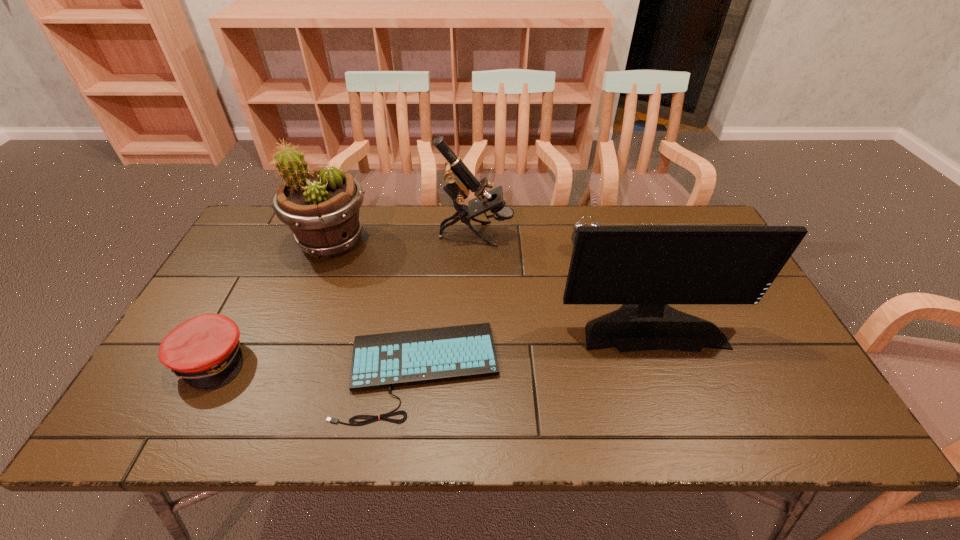
You are a GUI agent. You are given a task and a screenshot of the screen. Output one action in this format:
    pyautogui.click(x=<x>, y=<y>)
    Task: Click on the vacant space located 0.250m at the front of the cap where the visor is located
    The image size is (960, 540).
    Given the screenshot: What is the action you would take?
    pyautogui.click(x=349, y=360)

Find the location of a particular element. This screenshot has width=960, height=540. vacant space situated 0.120m on the left of the shortest object is located at coordinates (290, 369).

This screenshot has height=540, width=960. I want to click on flowerpot that is at the far edge, so click(321, 207).

In order to click on microscope situated at the far edge in this screenshot , I will do `click(459, 179)`.

At what (x,y) coordinates should I click in order to perform the action: click on alarm clock present at the far edge. Please return your answer as a coordinate pair (x, y). The height and width of the screenshot is (540, 960). Looking at the image, I should click on (579, 223).

Locate an element on the screen. This screenshot has height=540, width=960. object situated at the near edge is located at coordinates pyautogui.click(x=386, y=360).

Identify the location of flowerpot situated at the left edge. This screenshot has width=960, height=540. (321, 207).

Where is `cap that is at the left edge`? The height and width of the screenshot is (540, 960). cap that is at the left edge is located at coordinates (204, 351).

Where is `object that is at the right edge`? object that is at the right edge is located at coordinates (645, 268).

What are the coordinates of `object at the far left corner` in the screenshot? It's located at (321, 207).